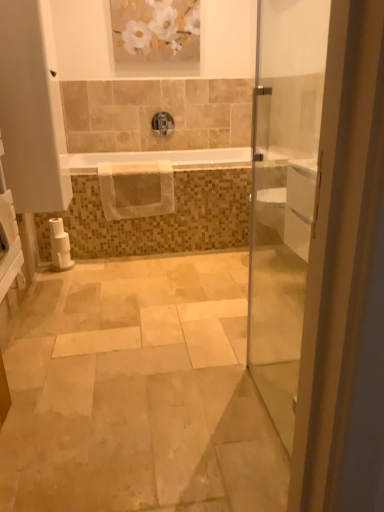
Question: From their relative heights in the image, would you say white matte painting at upper center is taller or shorter than white glossy door at right?

Choices:
 (A) tall
 (B) short

Answer: (B)

Question: In the image, is white matte painting at upper center on the left side or the right side of white glossy door at right?

Choices:
 (A) right
 (B) left

Answer: (B)

Question: Considering the real-world distances, which object is closest to the white textured hand towel at center?

Choices:
 (A) white glossy bathtub at center
 (B) white matte painting at upper center
 (C) white glossy door at right
 (D) satin nickel faucet at upper center
 (E) white matte toilet paper at lower left

Answer: (A)

Question: Which object is positioned farthest from the white glossy door at right?

Choices:
 (A) satin nickel faucet at upper center
 (B) white textured hand towel at center
 (C) white matte painting at upper center
 (D) white glossy bathtub at center
 (E) white matte toilet paper at lower left

Answer: (E)